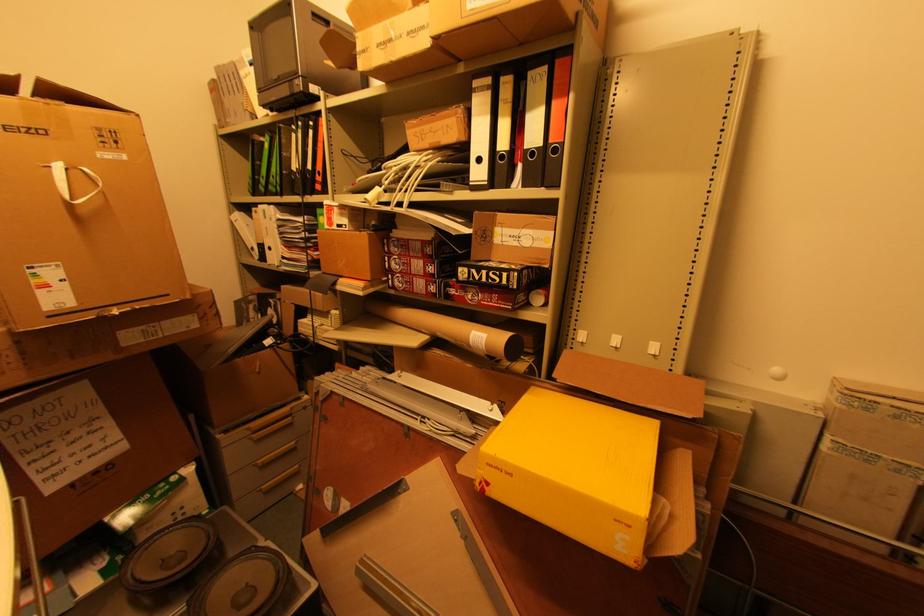
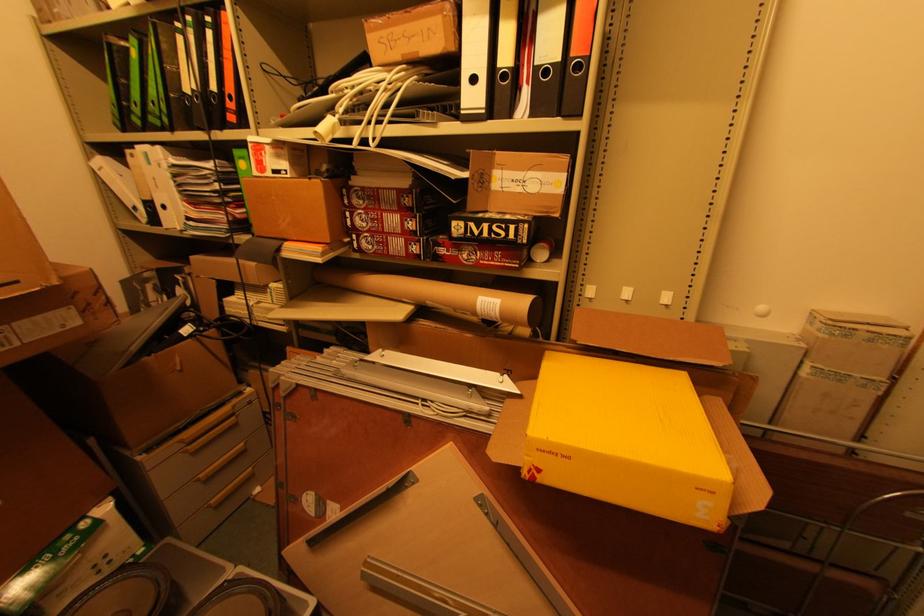
From the picture: The images are taken continuously from a first-person perspective. In which direction are you moving?

The cameraman walked toward left, forward.